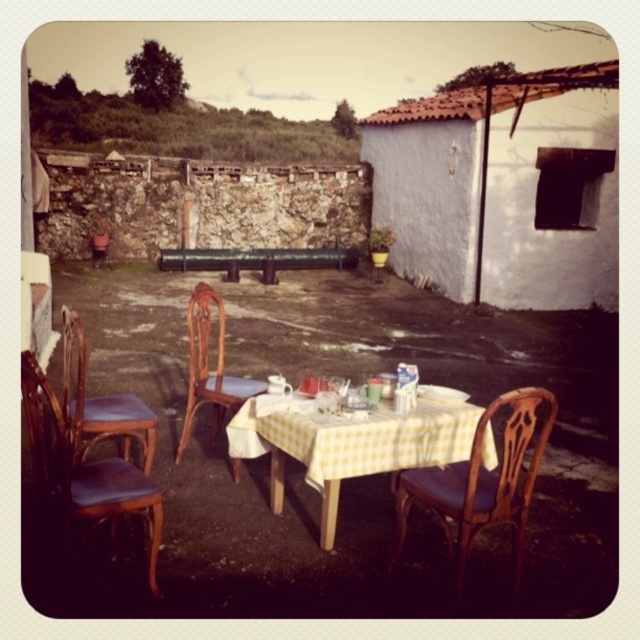
You are standing at the edge of the patio and want to walk towards the white stucco hut at upper right and the yellow checkered tablecloth at center. Which object will you encounter first?

You will encounter the yellow checkered tablecloth at center first because it is closer to you than the white stucco hut at upper right, which is further away.

You are sitting at the brown wooden chair at center and want to move to the brown leather chair at left. Which direction should you face to walk towards it?

You should face the left direction to walk towards the brown leather chair at left since it is located below the brown wooden chair at center, meaning it is positioned to the left side in the frame.